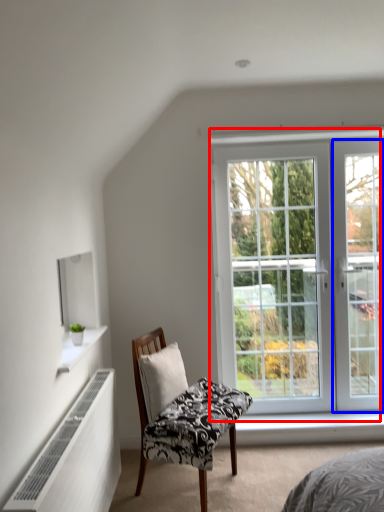
Question: Which point is closer to the camera, window (highlighted by a red box) or screen door (highlighted by a blue box)?

Choices:
 (A) window
 (B) screen door

Answer: (A)